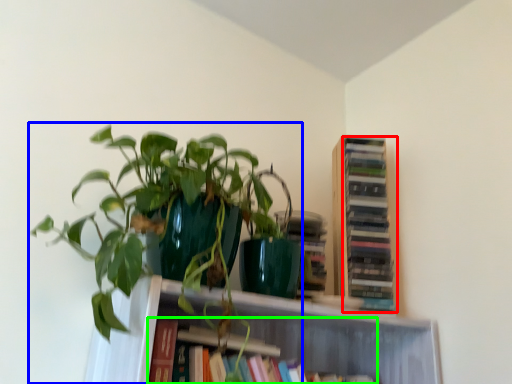
Question: Estimate the real-world distances between objects in this image. Which object is closer to book (highlighted by a red box), houseplant (highlighted by a blue box) or book (highlighted by a green box)?

Choices:
 (A) houseplant
 (B) book

Answer: (B)